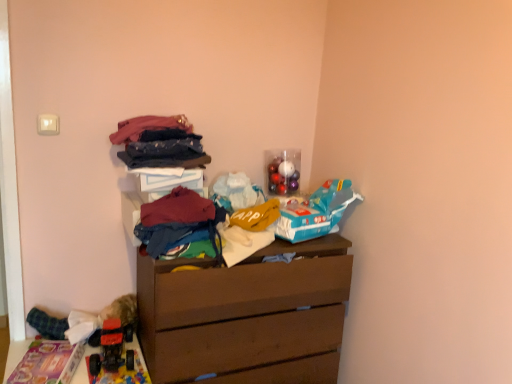
Question: From the image's perspective, is blue matte toy airplane at upper right, arranged as the third toy when ordered from the bottom, on top of maroon fabric at center, which ranks as the second clothing in bottom-to-top order?

Choices:
 (A) yes
 (B) no

Answer: (B)

Question: Is blue matte toy airplane at upper right, the first toy viewed from the right, oriented away from maroon fabric at center, the fourth clothing viewed from the top?

Choices:
 (A) no
 (B) yes

Answer: (A)

Question: Is blue matte toy airplane at upper right, the 4th toy in the left-to-right sequence, closer to camera compared to maroon fabric at center, which ranks as the second clothing in bottom-to-top order?

Choices:
 (A) no
 (B) yes

Answer: (A)

Question: Is blue matte toy airplane at upper right, positioned as the second toy in top-to-bottom order, shorter than maroon fabric at center, the fourth clothing viewed from the top?

Choices:
 (A) yes
 (B) no

Answer: (B)

Question: From the image's perspective, would you say blue matte toy airplane at upper right, positioned as the second toy in top-to-bottom order, is shown under maroon fabric at center, which ranks as the second clothing in bottom-to-top order?

Choices:
 (A) no
 (B) yes

Answer: (B)

Question: Is blue matte toy airplane at upper right, the 4th toy in the left-to-right sequence, taller than maroon fabric at center, which ranks as the second clothing in bottom-to-top order?

Choices:
 (A) yes
 (B) no

Answer: (A)

Question: Is brown matte chest of drawers at center smaller than multicolored fabric pile at center, marked as the fifth clothing in a top-to-bottom arrangement?

Choices:
 (A) yes
 (B) no

Answer: (B)

Question: Is brown matte chest of drawers at center behind multicolored fabric pile at center, marked as the fifth clothing in a top-to-bottom arrangement?

Choices:
 (A) yes
 (B) no

Answer: (A)

Question: Could you tell me if brown matte chest of drawers at center is turned towards multicolored fabric pile at center, marked as the fifth clothing in a top-to-bottom arrangement?

Choices:
 (A) no
 (B) yes

Answer: (A)

Question: From a real-world perspective, is brown matte chest of drawers at center under multicolored fabric pile at center, the first clothing in the bottom-to-top sequence?

Choices:
 (A) yes
 (B) no

Answer: (A)

Question: Is brown matte chest of drawers at center to the right of multicolored fabric pile at center, the first clothing in the bottom-to-top sequence, from the viewer's perspective?

Choices:
 (A) yes
 (B) no

Answer: (A)

Question: Is multicolored fabric pile at center, the first clothing in the bottom-to-top sequence, completely or partially inside brown matte chest of drawers at center?

Choices:
 (A) yes
 (B) no

Answer: (B)

Question: Considering the relative positions of plastic toy car at lower left and denim jeans at upper center, placed as the 4th clothing when sorted from bottom to top, in the image provided, is plastic toy car at lower left in front of denim jeans at upper center, placed as the 4th clothing when sorted from bottom to top,?

Choices:
 (A) yes
 (B) no

Answer: (A)